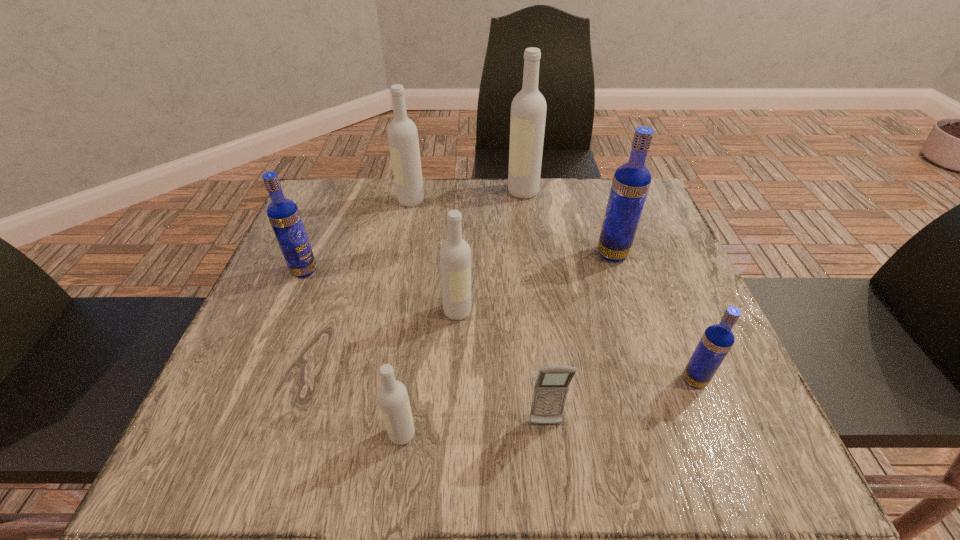
The width and height of the screenshot is (960, 540). What are the coordinates of `the biggest white vodka` in the screenshot? It's located at (528, 109).

Where is `the third vodka from right to left`? the third vodka from right to left is located at coordinates (528, 109).

You are a GUI agent. You are given a task and a screenshot of the screen. Output one action in this format:
    pyautogui.click(x=<x>, y=<y>)
    Task: Click on the second vodka from left to right
    The height and width of the screenshot is (540, 960).
    Given the screenshot: What is the action you would take?
    pyautogui.click(x=403, y=140)

Locate an element on the screen. This screenshot has width=960, height=540. the second object from left to right is located at coordinates (403, 140).

I want to click on the sixth vodka from left to right, so click(631, 181).

This screenshot has height=540, width=960. What are the coordinates of `the seventh object from left to right` in the screenshot? It's located at [631, 181].

Identify the location of the leftmost vodka. (283, 214).

Identify the location of the second biggest blue vodka. This screenshot has height=540, width=960. (283, 214).

Where is `the fourth vodka from right to left`? The image size is (960, 540). the fourth vodka from right to left is located at coordinates (455, 254).

I want to click on the second smallest white vodka, so click(455, 254).